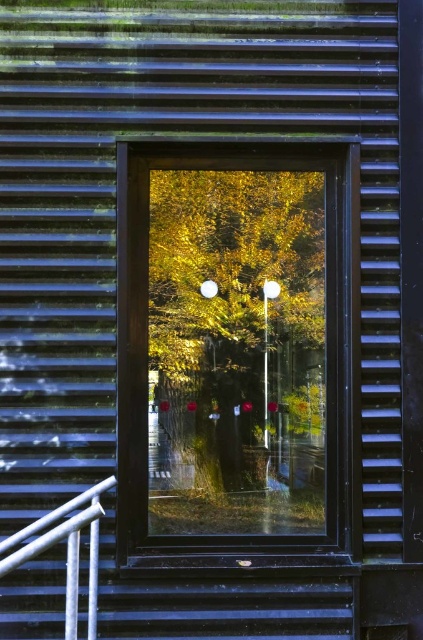
You are standing in front of a large window with a dark frame and slats. You see a golden leafy tree at center and a white glossy rail at lower left. Which object is higher in the window?

The golden leafy tree at center is located above the white glossy rail at lower left, so it is higher in the window.

You are standing in front of the building and see the golden leafy tree at center and the white glossy rail at lower left. Which object is located to the right of the other?

The golden leafy tree at center is positioned on the right side of white glossy rail at lower left.

You are standing in front of the large window and want to touch both points on the window. Which point should you reach for first, the point at coordinates (249, 330) or the point at (38, 547)?

You should reach for the point at coordinates (249, 330) first because it is closer to you than the point at (38, 547), which is further away.